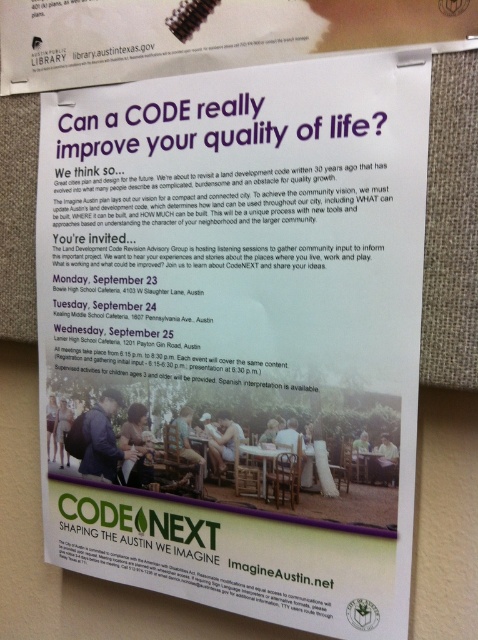
Measure the distance between white paper at upper center and white glossy table at center.

white paper at upper center and white glossy table at center are 17.61 inches apart from each other.

Describe the element at coordinates (206, 35) in the screenshot. I see `white paper at upper center` at that location.

Is point (51, 77) in front of point (264, 456)?

No, it is behind (264, 456).

Identify the location of white paper at upper center. (206, 35).

Does wooden table at lower center have a larger size compared to white glossy table at center?

No, wooden table at lower center is not bigger than white glossy table at center.

Can you confirm if wooden table at lower center is wider than white glossy table at center?

In fact, wooden table at lower center might be narrower than white glossy table at center.

Image resolution: width=478 pixels, height=640 pixels. What do you see at coordinates (368, 467) in the screenshot?
I see `wooden table at lower center` at bounding box center [368, 467].

Identify the location of wooden table at lower center. The width and height of the screenshot is (478, 640). [x=368, y=467].

Between white paper at upper center and wooden table at lower center, which one is positioned higher?

white paper at upper center is above.

The height and width of the screenshot is (640, 478). I want to click on white paper at upper center, so click(206, 35).

Based on the photo, measure the distance between white paper at upper center and camera.

They are 21.61 inches apart.

Image resolution: width=478 pixels, height=640 pixels. What are the coordinates of `white paper at upper center` in the screenshot? It's located at (206, 35).